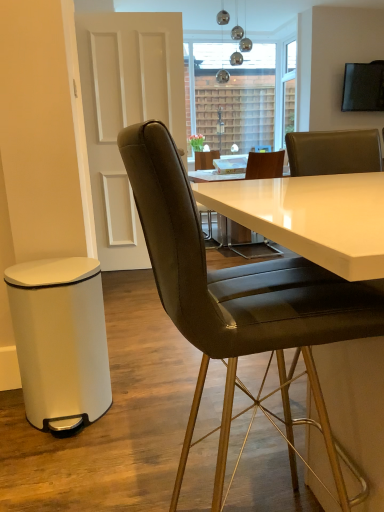
The height and width of the screenshot is (512, 384). I want to click on vacant area that is in front of white glossy door at upper left, so click(130, 282).